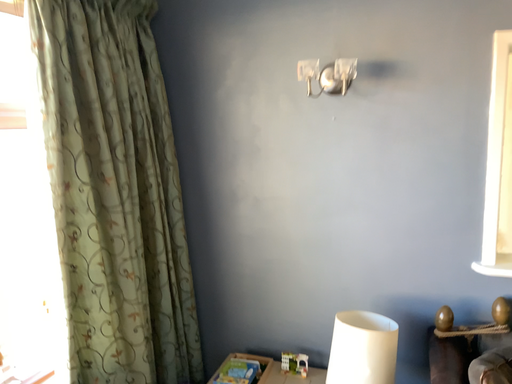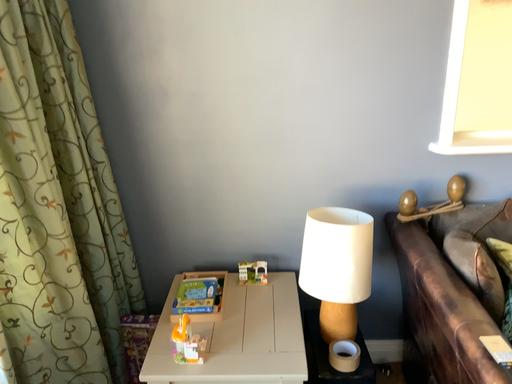
Question: How did the camera likely rotate when shooting the video?

Choices:
 (A) rotated upward
 (B) rotated downward

Answer: (B)